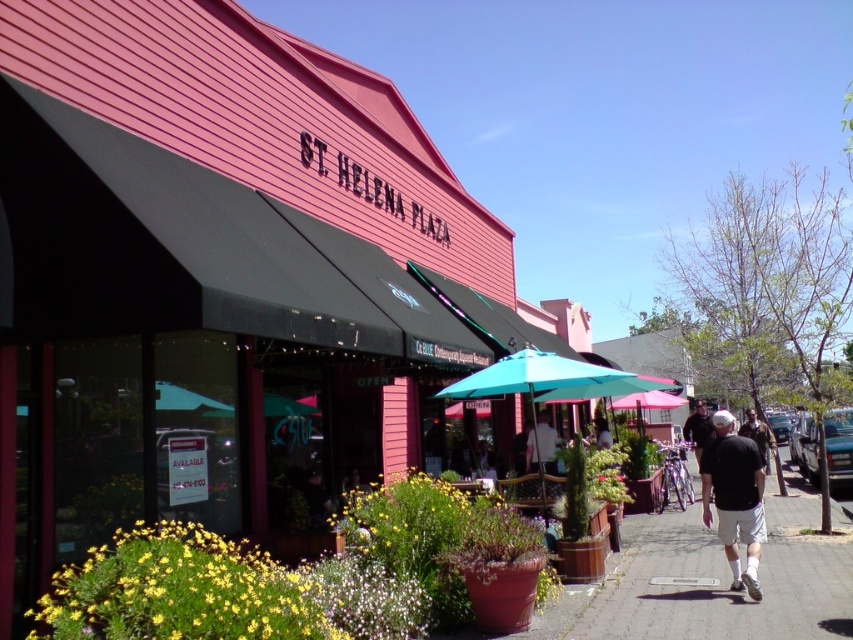
You are a customer sitting at the teal fabric umbrella at center. You want to place your black fabric shirt at lower right under the umbrella to stay dry during an unexpected rain shower. Is the umbrella currently positioned in a way that it can cover your shirt?

The teal fabric umbrella at center is positioned over the black fabric shirt at lower right, so yes, the umbrella is currently covering the shirt and can keep it dry during the rain.

Based on the photo, you are a photographer at St. Helena Plaza and want to capture both the matte white shirt at center and the dark gray shirt at center in the same frame. Which shirt should you position closer to the left side of your camera viewfinder to ensure both are visible?

You should position the matte white shirt at center closer to the left side of your camera viewfinder since it is already to the left of the dark gray shirt at center in the scene.